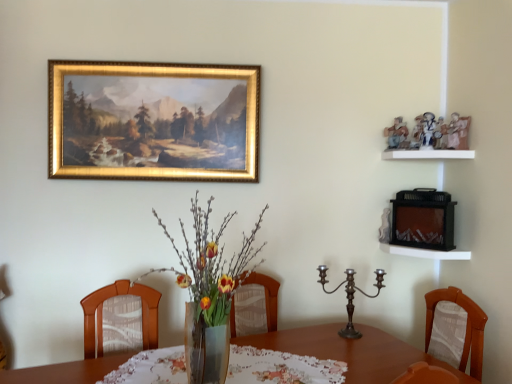
Question: Would you say translucent glass vase at center is to the left or to the right of gold-framed painting at upper center in the picture?

Choices:
 (A) right
 (B) left

Answer: (A)

Question: Looking at their shapes, would you say translucent glass vase at center is wider or thinner than gold-framed painting at upper center?

Choices:
 (A) wide
 (B) thin

Answer: (A)

Question: Which is farther from the white wooden shelf at right, which ranks as the second shelf in top-to-bottom order?

Choices:
 (A) printed fabric tablecloth at center
 (B) white matte shelf at upper right, positioned as the 1th shelf in top-to-bottom order
 (C) gold-framed painting at upper center
 (D) translucent glass vase at center
 (E) polished bronze candelabra at center

Answer: (C)

Question: Considering the real-world distances, which object is closest to the white matte shelf at upper right, the 2th shelf when ordered from bottom to top?

Choices:
 (A) printed fabric tablecloth at center
 (B) polished bronze candelabra at center
 (C) gold-framed painting at upper center
 (D) white wooden shelf at right, which ranks as the second shelf in top-to-bottom order
 (E) translucent glass vase at center

Answer: (D)